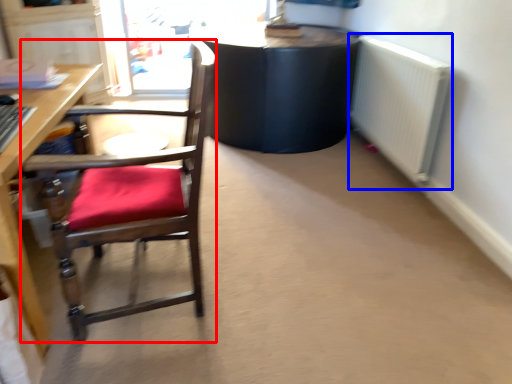
Question: Among these objects, which one is nearest to the camera, chair (highlighted by a red box) or radiator (highlighted by a blue box)?

Choices:
 (A) chair
 (B) radiator

Answer: (A)